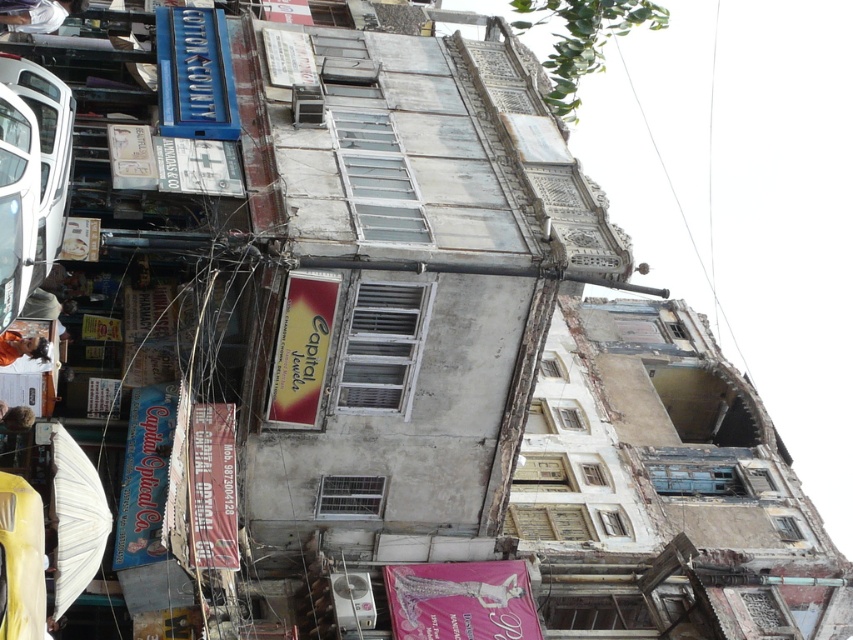
You are standing at the camera position looking at the building. There is a point marked at coordinates point (6, 22). Can you safely walk towards that point without getting too close to the building?

The point (6, 22) is 54.89 meters away from the camera, so yes, you can safely walk towards it without getting too close to the building.

You are a pedestrian standing on the street looking at the Capital Jewels sign. There is a white glossy car at left and a light brown hair at lower left. Which object is nearer to you?

The white glossy car at left is closer to the viewer than the light brown hair at lower left.